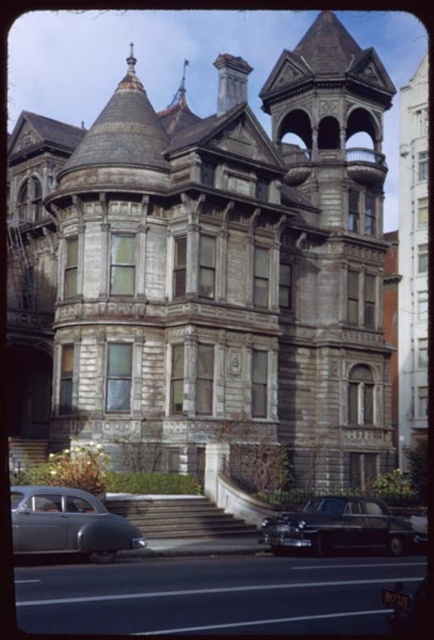
You are a delivery driver approaching the stone mansion at center and the silver metallic car at lower left. Which one is closer to the road?

The silver metallic car at lower left is closer to the road because the stone mansion at center is positioned on the right side of the silver metallic car at lower left, meaning the car is nearer to the road compared to the mansion.

You are a delivery person needing to park your 5.5 meter long truck between the stone mansion at center and the shiny black sedan at lower center. Can you safely park your truck there without hitting either the mansion or the sedan?

The distance between the stone mansion at center and the shiny black sedan at lower center is 17.61 meters. Since your truck is only 5.5 meters long, there is ample space to park safely without hitting either object.

You are standing in front of the mansion and want to park your car. You have two options, the silver metallic car at lower left and the shiny black sedan at lower center. Which car is closer to you so you can easily access it?

The silver metallic car at lower left is closer to the viewer than the shiny black sedan at lower center, so you can easily access it.